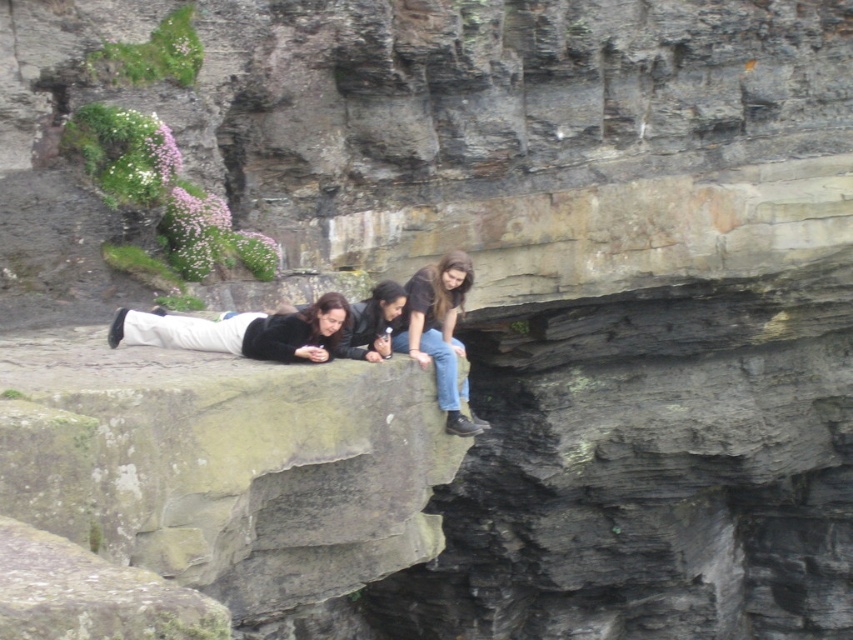
You are standing on the cliff and want to hand a camera to the person wearing the matte black jacket at center and the jeans at center. Which one should you approach first to give the camera?

You should approach the matte black jacket at center first because it is closer to you than the jeans at center, which is further away.

You are standing at the base of the cliff and want to throw a small pebble to reach the matte black jacket at center. Given that the cliff is 30 meters high, can you estimate if the pebble will reach the jacket?

The matte black jacket at center is 32.21 meters from the viewer. Since the cliff is only 30 meters high, the horizontal distance would need to be calculated. However, without knowing the angle or trajectory, it is impossible to determine if the pebble can reach the jacket. Additionally, the jacket is farther away horizontally than the cliff is high, so even if thrown straight horizontally, the pebble would fall short due to gravity.

You are a photographer trying to capture a detailed shot of the matte black jacket at center and the jeans at center. Since the jacket is smaller, which one should you zoom in on more to ensure both are clearly visible in the photo?

The matte black jacket at center is smaller than the jeans at center, so you should zoom in more on the jeans at center to ensure both are clearly visible in the photo.